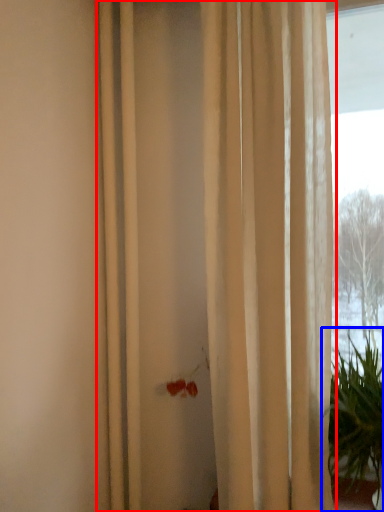
Question: Which object appears farthest to the camera in this image, curtain (highlighted by a red box) or houseplant (highlighted by a blue box)?

Choices:
 (A) curtain
 (B) houseplant

Answer: (A)